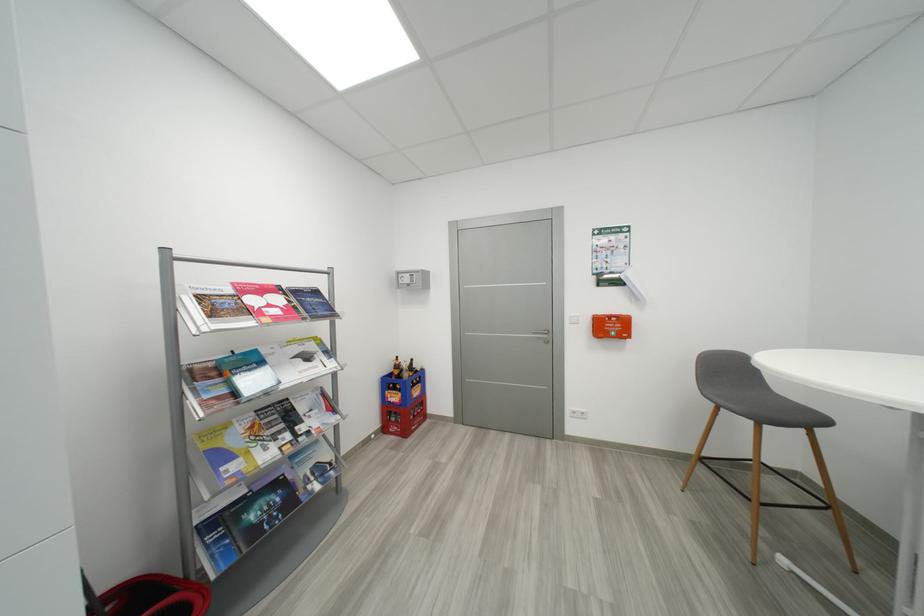
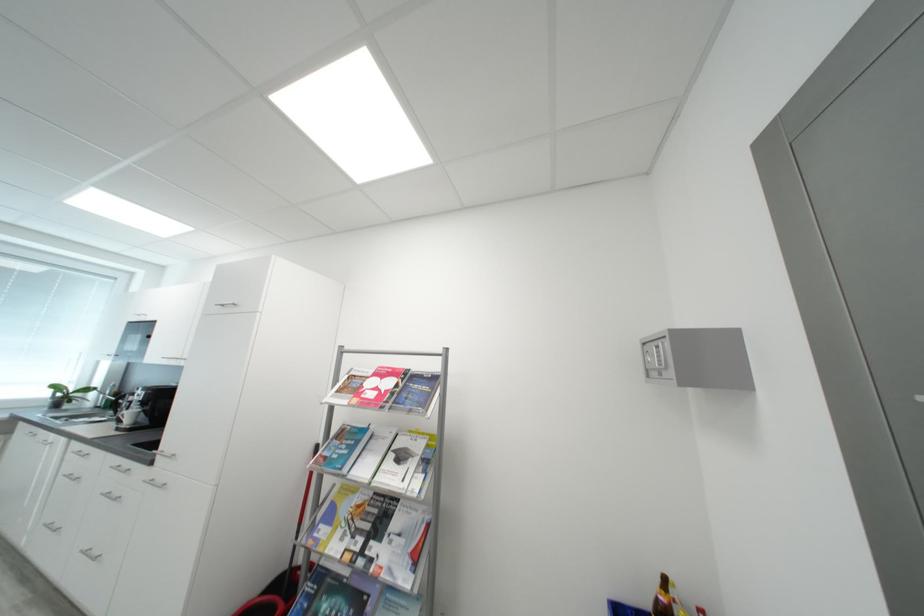
Where in the second image is the point corresponding to [419,282] from the first image?

(666, 362)